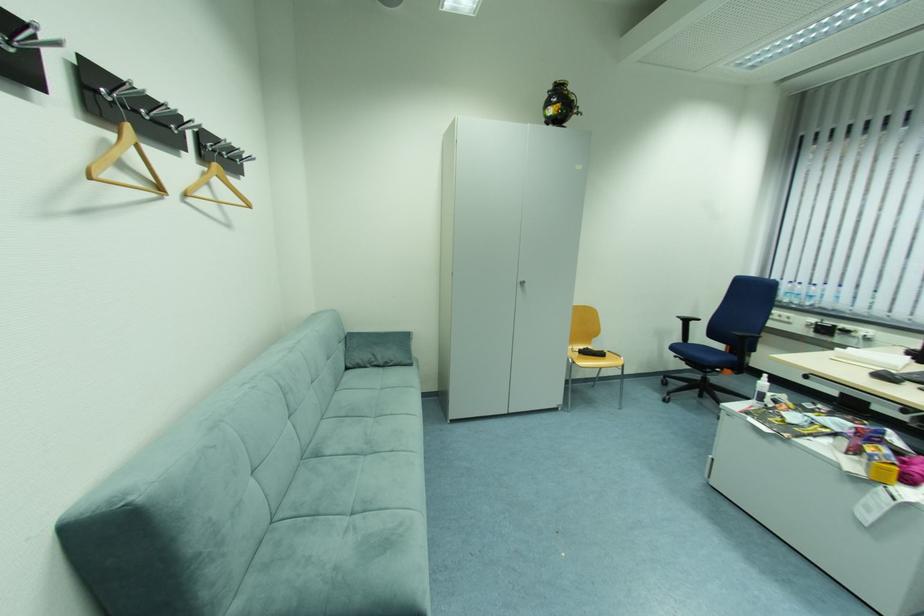
What do you see at coordinates (761, 389) in the screenshot?
I see `the white spray bottle` at bounding box center [761, 389].